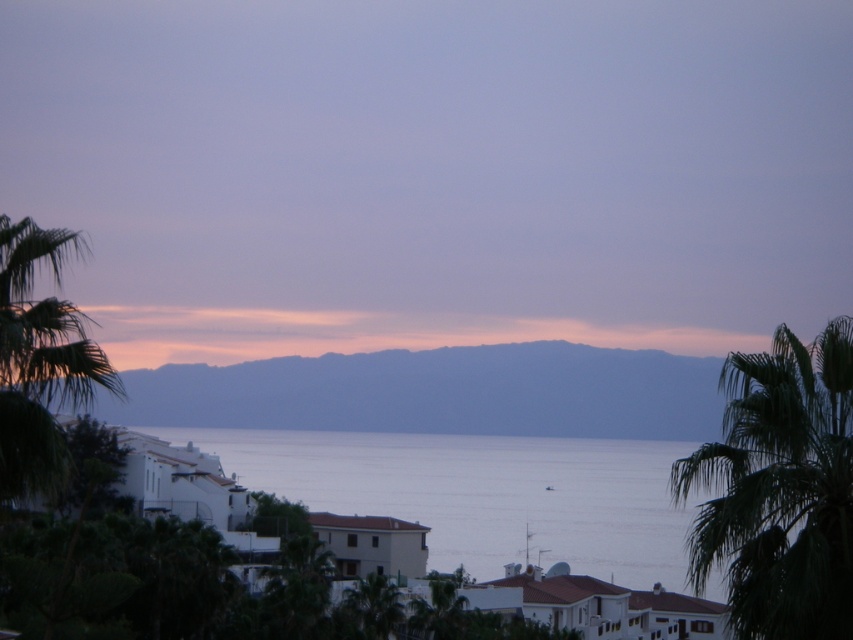
Between point (497, 541) and point (79, 253), which one is positioned in front?

Point (79, 253) is more forward.

Does blue water at center have a smaller size compared to green leafy palm tree at left?

Actually, blue water at center might be larger than green leafy palm tree at left.

Between point (515, 528) and point (4, 298), which one is positioned in front?

Point (4, 298) is more forward.

Image resolution: width=853 pixels, height=640 pixels. Identify the location of blue water at center. (483, 493).

Which is more to the left, dull blue sky at center or green leafy palm tree at right?

dull blue sky at center is more to the left.

Which is in front, point (497, 420) or point (699, 451)?

Positioned in front is point (699, 451).

You are a GUI agent. You are given a task and a screenshot of the screen. Output one action in this format:
    pyautogui.click(x=<x>, y=<y>)
    Task: Click on the dull blue sky at center
    
    Given the screenshot: What is the action you would take?
    pyautogui.click(x=439, y=392)

Can you confirm if dull blue sky at center is positioned below green leafy palm tree at left?

Yes.

At what (x,y) coordinates should I click in order to perform the action: click on dull blue sky at center. Please return your answer as a coordinate pair (x, y). Looking at the image, I should click on (439, 392).

The height and width of the screenshot is (640, 853). What are the coordinates of `dull blue sky at center` in the screenshot? It's located at (439, 392).